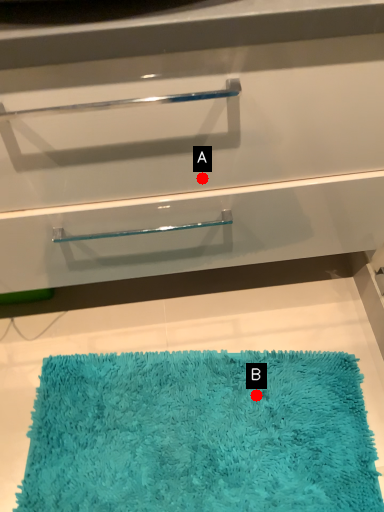
Question: Two points are circled on the image, labeled by A and B beside each circle. Among these points, which one is nearest to the camera?

Choices:
 (A) A is closer
 (B) B is closer

Answer: (A)